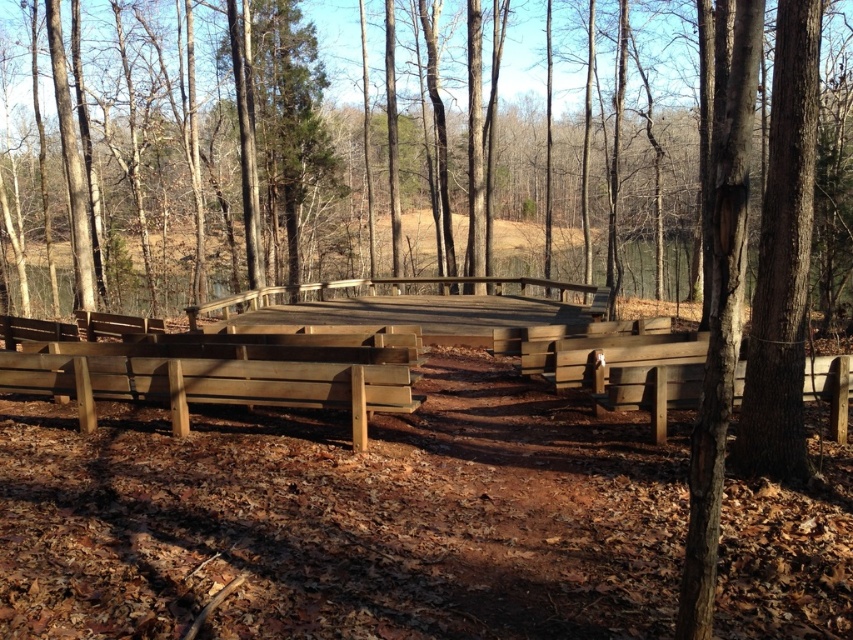
Question: Does wooden bench at lower center appear under wooden bench at right?

Choices:
 (A) no
 (B) yes

Answer: (A)

Question: Does wooden bench at lower center appear on the left side of wooden bench at right?

Choices:
 (A) yes
 (B) no

Answer: (A)

Question: Does wooden bench at lower center appear under wooden bench at right?

Choices:
 (A) yes
 (B) no

Answer: (B)

Question: Which point is closer to the camera?

Choices:
 (A) (682, 397)
 (B) (96, 378)

Answer: (A)